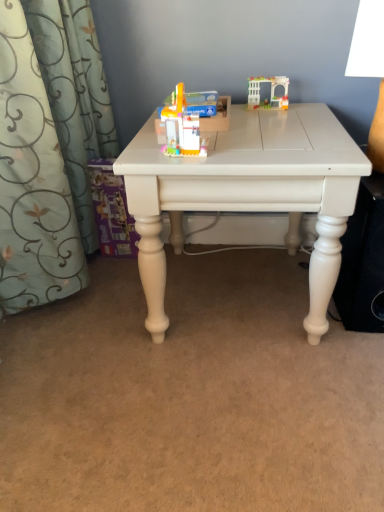
This screenshot has height=512, width=384. I want to click on free region on the left part of white matte table at center, so click(84, 328).